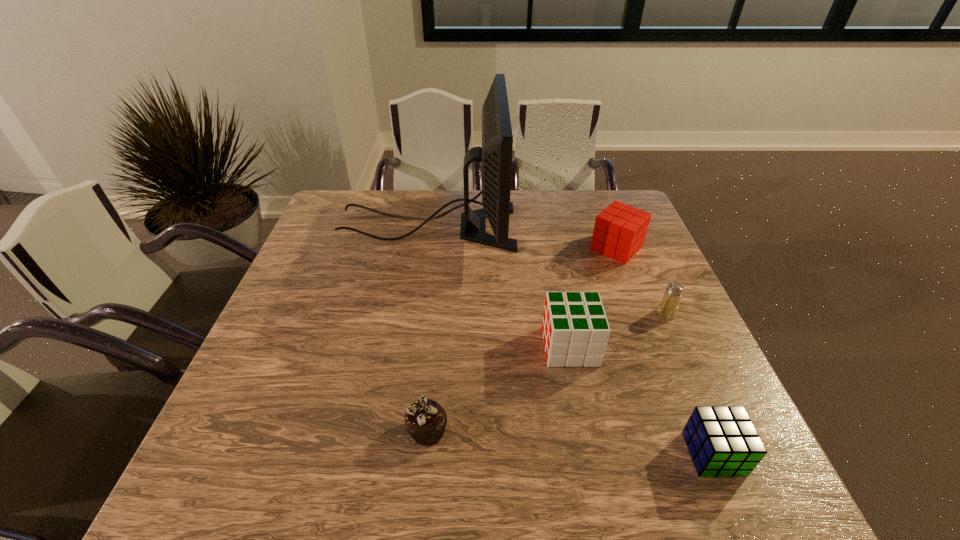
Identify the location of free point located on the red face of the third object from left to right. The height and width of the screenshot is (540, 960). (517, 347).

Locate an element on the screen. This screenshot has width=960, height=540. vacant area situated on the front of the farthest cube is located at coordinates (630, 281).

I want to click on vacant area situated on the front of the saltshaker, so click(691, 371).

You are a GUI agent. You are given a task and a screenshot of the screen. Output one action in this format:
    pyautogui.click(x=<x>, y=<y>)
    Task: Click on the vacant region located on the left of the shortest cube
    The image size is (960, 540).
    Given the screenshot: What is the action you would take?
    pyautogui.click(x=651, y=454)

Find the location of a particular element. The image size is (960, 540). vacant space located 0.250m on the right of the cupcake is located at coordinates (578, 430).

Locate an element on the screen. Image resolution: width=960 pixels, height=540 pixels. object that is at the far edge is located at coordinates (495, 154).

Identify the location of object that is at the near edge. The image size is (960, 540). (722, 441).

What are the coordinates of `object present at the left edge` in the screenshot? It's located at (495, 154).

You are a GUI agent. You are given a task and a screenshot of the screen. Output one action in this format:
    pyautogui.click(x=<x>, y=<y>)
    Task: Click on the saltshaker present at the right edge
    
    Given the screenshot: What is the action you would take?
    pyautogui.click(x=669, y=304)

Locate an element on the screen. The width and height of the screenshot is (960, 540). object at the far left corner is located at coordinates (495, 154).